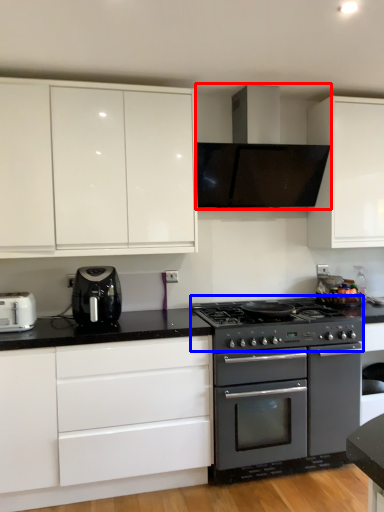
Question: Which point is further to the camera, home appliance (highlighted by a red box) or gas stove (highlighted by a blue box)?

Choices:
 (A) home appliance
 (B) gas stove

Answer: (A)